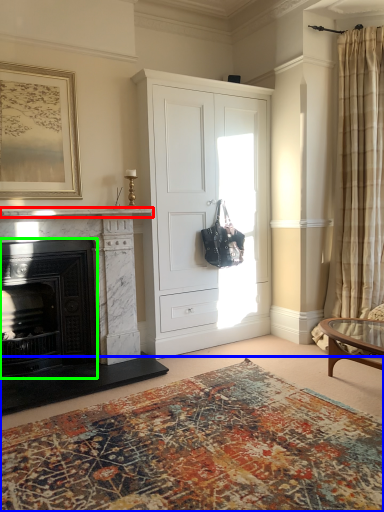
Question: Based on their relative distances, which object is nearer to mantle (highlighted by a red box)? Choose from hardwood (highlighted by a blue box) and fireplace (highlighted by a green box).

Choices:
 (A) hardwood
 (B) fireplace

Answer: (B)